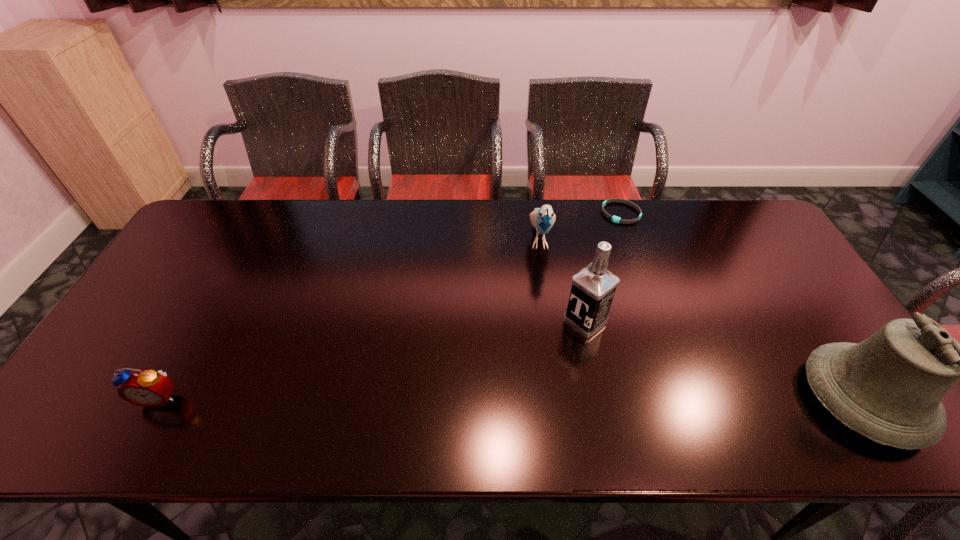
Where is `free space on the desktop that is between the fourth tallest object and the bell and is positioned on the buckle of the shortest object`? The height and width of the screenshot is (540, 960). free space on the desktop that is between the fourth tallest object and the bell and is positioned on the buckle of the shortest object is located at coordinates (557, 398).

Locate an element on the screen. The width and height of the screenshot is (960, 540). vacant spot on the desktop that is between the alarm clock and the rightmost object and is positioned at the face of the third shortest object is located at coordinates (548, 398).

Find the location of a particular element. This screenshot has width=960, height=540. free spot on the desktop that is between the second shortest object and the bell and is positioned on the front label of the vodka is located at coordinates pyautogui.click(x=490, y=398).